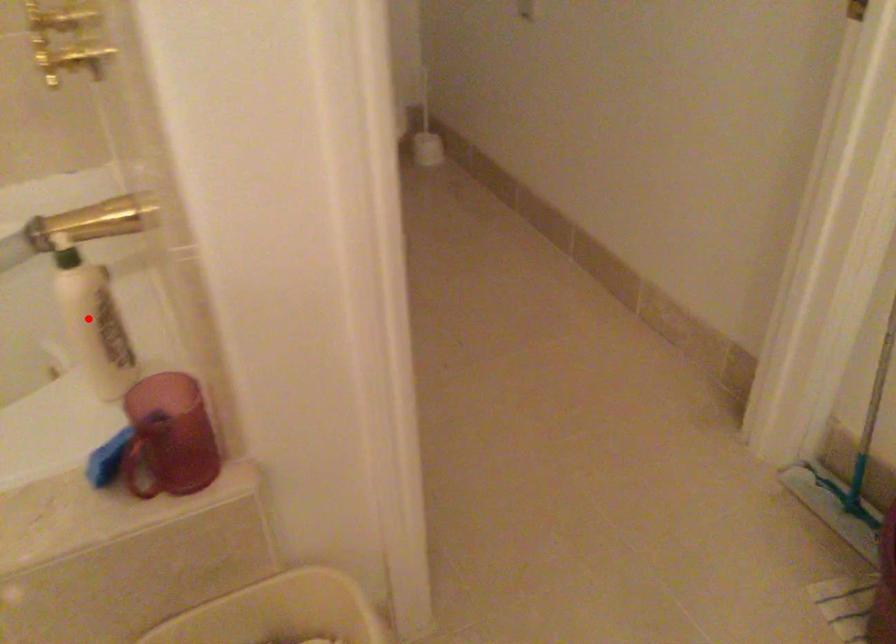
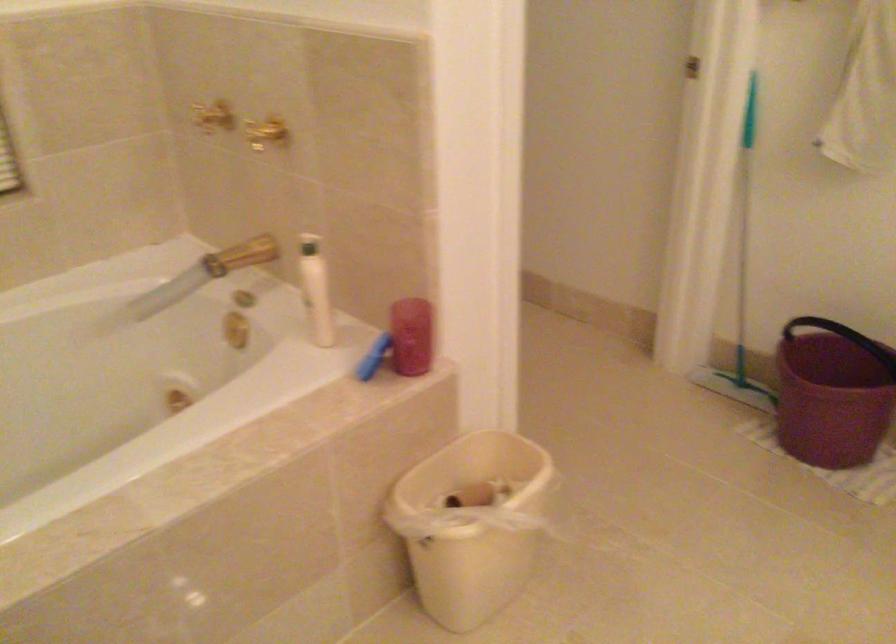
Question: I am providing you with two images of the same scene from different viewpoints. A red point is shown in image1. For the corresponding object point in image2, is it positioned nearer or farther from the camera?

Choices:
 (A) Nearer
 (B) Farther

Answer: (B)